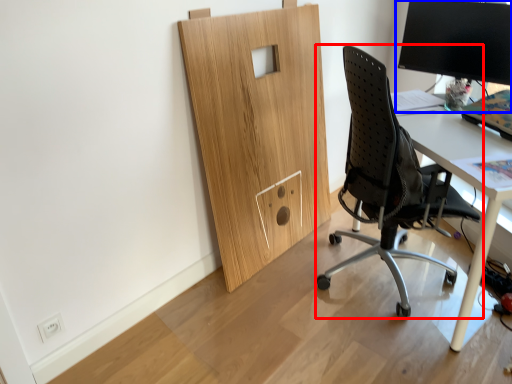
Question: Among these objects, which one is farthest to the camera, chair (highlighted by a red box) or desktop computer (highlighted by a blue box)?

Choices:
 (A) chair
 (B) desktop computer

Answer: (B)